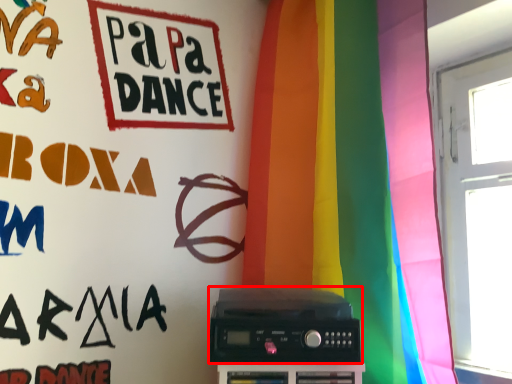
Question: Considering the relative positions of amplifier (annotated by the red box) and curtain in the image provided, where is amplifier (annotated by the red box) located with respect to the staircase?

Choices:
 (A) left
 (B) right

Answer: (A)